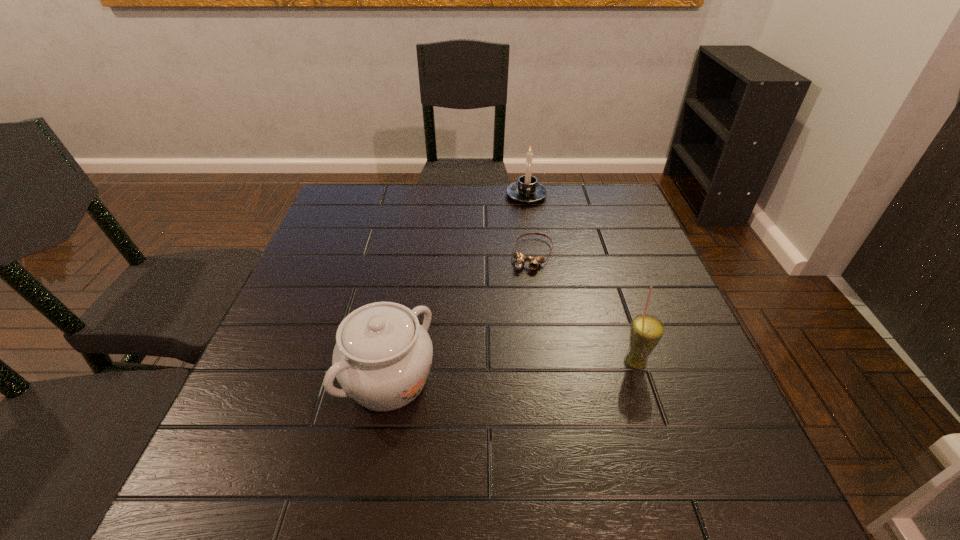
Find the location of a particular element. chinaware is located at coordinates (382, 357).

This screenshot has width=960, height=540. I want to click on straw for drinking, so click(646, 331).

You are a GUI agent. You are given a task and a screenshot of the screen. Output one action in this format:
    pyautogui.click(x=<x>, y=<y>)
    Task: Click on the candle holder
    
    Given the screenshot: What is the action you would take?
    pyautogui.click(x=527, y=190)

Where is `the shortest object`? The width and height of the screenshot is (960, 540). the shortest object is located at coordinates (520, 261).

Find the location of a particular element. the third nearest object is located at coordinates (520, 261).

At what (x,y) coordinates should I click in order to perform the action: click on vacant space located on the back of the chinaware. Please return your answer as a coordinate pair (x, y). The height and width of the screenshot is (540, 960). Looking at the image, I should click on (401, 314).

You are a GUI agent. You are given a task and a screenshot of the screen. Output one action in this format:
    pyautogui.click(x=<x>, y=<y>)
    Task: Click on the vacant space located on the back of the straw for drinking
    This screenshot has height=540, width=960.
    Given the screenshot: What is the action you would take?
    pyautogui.click(x=594, y=240)

Image resolution: width=960 pixels, height=540 pixels. Find the location of `vacant area situated with a handle on the side of the candle holder`. vacant area situated with a handle on the side of the candle holder is located at coordinates (533, 255).

The height and width of the screenshot is (540, 960). Identify the location of blank space located with a handle on the side of the candle holder. 531,231.

Image resolution: width=960 pixels, height=540 pixels. Identify the location of free spot located 0.300m with a handle on the side of the candle holder. (535, 269).